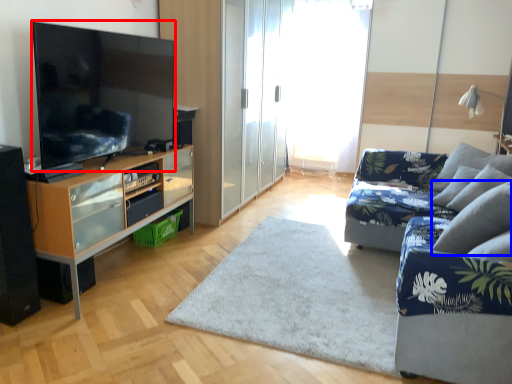
Question: Among these objects, which one is nearest to the camera, television (highlighted by a red box) or pillow (highlighted by a blue box)?

Choices:
 (A) television
 (B) pillow

Answer: (A)